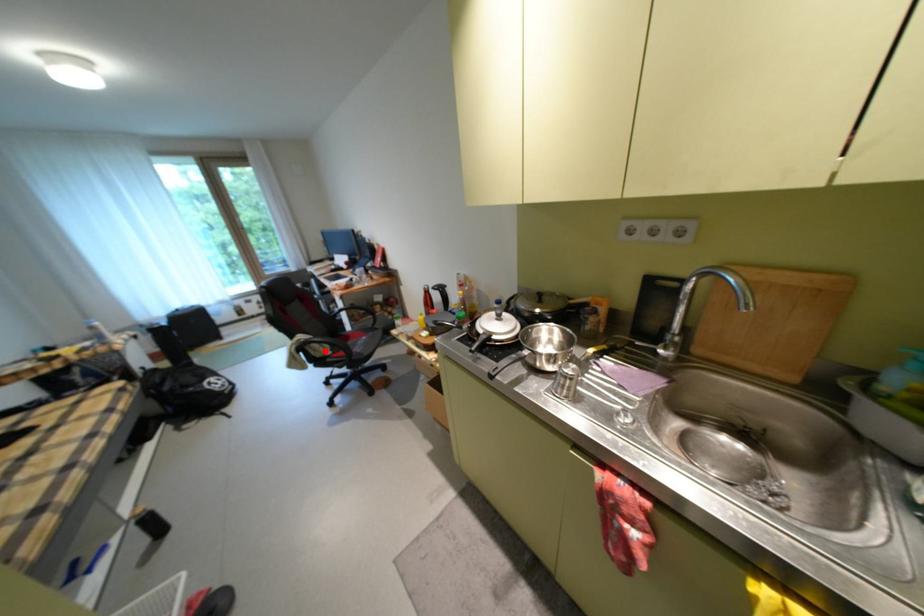
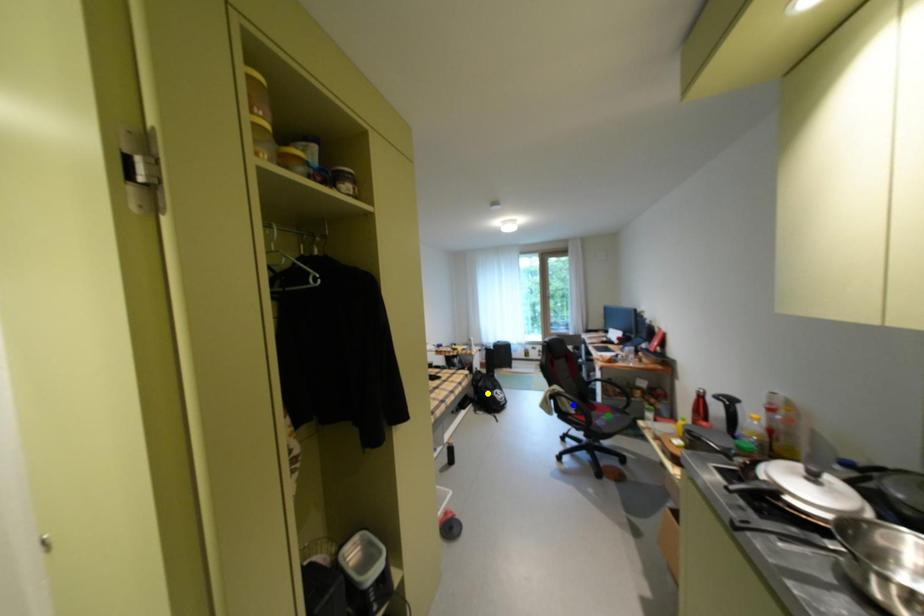
Question: I am providing you with two images of the same scene from different viewpoints. A red point is marked on the first image. You are given multiple points on the second image. Which mark in image 2 goes with the point in image 1?

Choices:
 (A) green point
 (B) yellow point
 (C) blue point

Answer: (C)